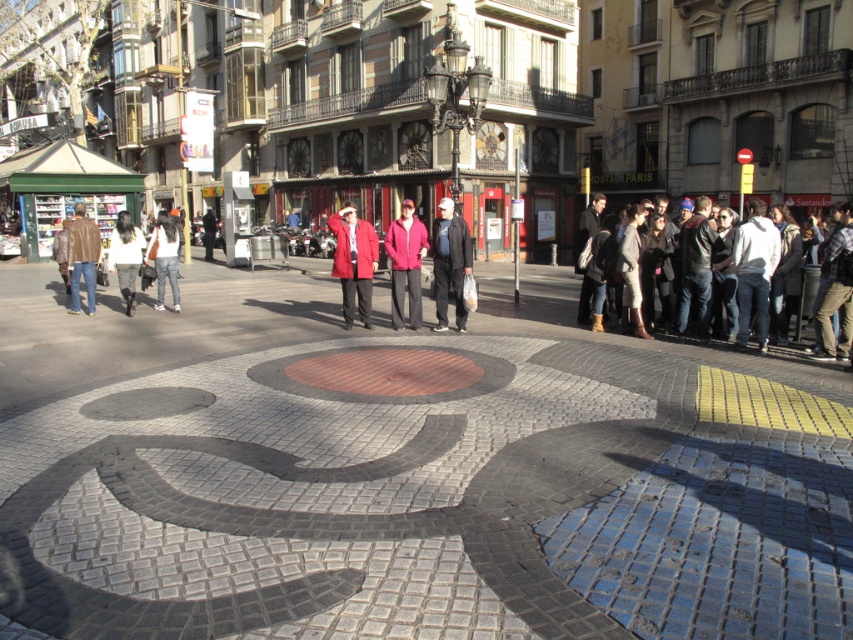
Question: Where is light gray sweater at right located in relation to brown leather jacket at left in the image?

Choices:
 (A) right
 (B) left

Answer: (A)

Question: Which of these objects is positioned closest to the brick mosaic at center?

Choices:
 (A) matte gray jacket at center
 (B) light gray sweater at right

Answer: (A)

Question: Among these points, which one is nearest to the camera?

Choices:
 (A) (97, 246)
 (B) (373, 260)

Answer: (B)

Question: Among these objects, which one is nearest to the camera?

Choices:
 (A) matte red coat at center
 (B) white fur coat at center
 (C) matte pink jacket at center
 (D) brick mosaic at center

Answer: (D)

Question: Considering the relative positions of denim jacket at lower right and matte red coat at center in the image provided, where is denim jacket at lower right located with respect to matte red coat at center?

Choices:
 (A) right
 (B) left

Answer: (A)

Question: Does brick mosaic at center appear on the right side of matte gray jacket at center?

Choices:
 (A) no
 (B) yes

Answer: (A)